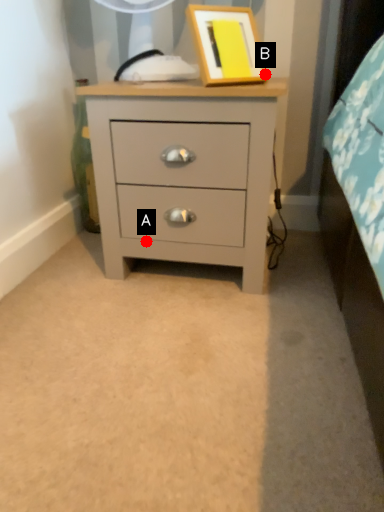
Question: Two points are circled on the image, labeled by A and B beside each circle. Which point is closer to the camera?

Choices:
 (A) A is closer
 (B) B is closer

Answer: (B)